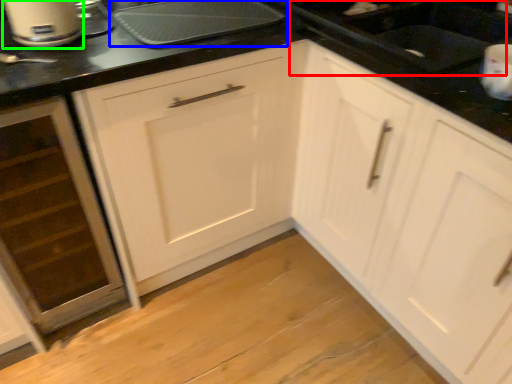
Question: Which object is the closest to the sink (highlighted by a red box)? Choose among these: kitchen appliance (highlighted by a blue box) or home appliance (highlighted by a green box).

Choices:
 (A) kitchen appliance
 (B) home appliance

Answer: (A)